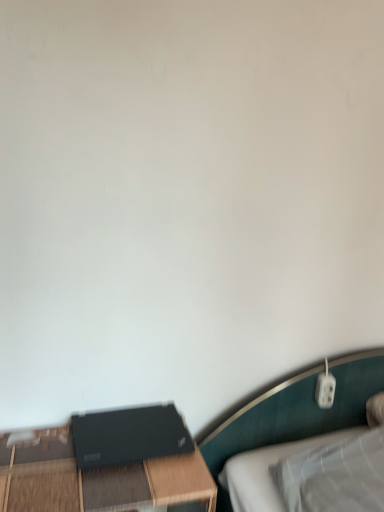
Question: Is black matte laptop at lower left shorter than black matte table at lower left?

Choices:
 (A) no
 (B) yes

Answer: (B)

Question: Is black matte table at lower left located within black matte laptop at lower left?

Choices:
 (A) no
 (B) yes

Answer: (A)

Question: Is black matte laptop at lower left located outside black matte table at lower left?

Choices:
 (A) no
 (B) yes

Answer: (B)

Question: Considering the relative positions of black matte laptop at lower left and black matte table at lower left in the image provided, is black matte laptop at lower left to the left of black matte table at lower left from the viewer's perspective?

Choices:
 (A) yes
 (B) no

Answer: (B)

Question: Is black matte laptop at lower left to the right of black matte table at lower left from the viewer's perspective?

Choices:
 (A) yes
 (B) no

Answer: (A)

Question: Is black matte laptop at lower left oriented towards black matte table at lower left?

Choices:
 (A) yes
 (B) no

Answer: (B)

Question: From a real-world perspective, is black matte table at lower left physically below black matte laptop at lower left?

Choices:
 (A) no
 (B) yes

Answer: (B)

Question: Is black matte table at lower left aimed at black matte laptop at lower left?

Choices:
 (A) yes
 (B) no

Answer: (B)

Question: From the image's perspective, is black matte table at lower left located beneath black matte laptop at lower left?

Choices:
 (A) no
 (B) yes

Answer: (B)

Question: Is black matte table at lower left outside of black matte laptop at lower left?

Choices:
 (A) no
 (B) yes

Answer: (B)

Question: Does black matte table at lower left have a larger size compared to black matte laptop at lower left?

Choices:
 (A) yes
 (B) no

Answer: (A)

Question: Is black matte table at lower left to the right of black matte laptop at lower left from the viewer's perspective?

Choices:
 (A) no
 (B) yes

Answer: (A)

Question: Is point (74, 446) positioned closer to the camera than point (8, 463)?

Choices:
 (A) farther
 (B) closer

Answer: (A)